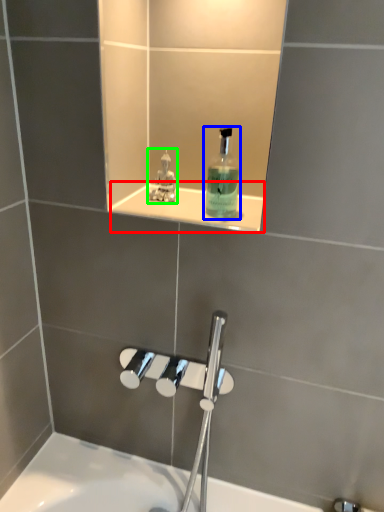
Question: Which is nearer to the ledge (highlighted by a red box)? mouthwash (highlighted by a blue box) or perfume (highlighted by a green box).

Choices:
 (A) mouthwash
 (B) perfume

Answer: (A)